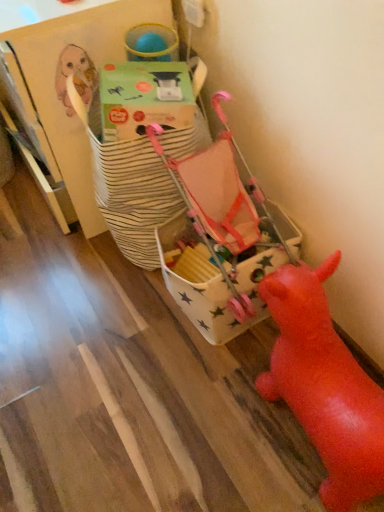
Question: Can you confirm if white star-patterned fabric bag at center, the 1th toy from the back, is wider than rubber red pig at lower right, acting as the second toy starting from the back?

Choices:
 (A) yes
 (B) no

Answer: (A)

Question: Is white star-patterned fabric bag at center, the 1th toy from the back, positioned with its back to rubber red pig at lower right, acting as the second toy starting from the back?

Choices:
 (A) yes
 (B) no

Answer: (B)

Question: Is white star-patterned fabric bag at center, the 1th toy from the back, positioned behind rubber red pig at lower right, acting as the second toy starting from the back?

Choices:
 (A) yes
 (B) no

Answer: (A)

Question: Can you confirm if white star-patterned fabric bag at center, the 1th toy from the back, is smaller than rubber red pig at lower right, acting as the second toy starting from the back?

Choices:
 (A) yes
 (B) no

Answer: (A)

Question: Is white star-patterned fabric bag at center, the 1th toy from the back, thinner than rubber red pig at lower right, the 1th toy in the front-to-back sequence?

Choices:
 (A) no
 (B) yes

Answer: (A)

Question: Can you confirm if white star-patterned fabric bag at center, the 1th toy from the back, is shorter than rubber red pig at lower right, the 1th toy in the front-to-back sequence?

Choices:
 (A) no
 (B) yes

Answer: (B)

Question: Is green cardboard box at upper center oriented towards white star-patterned fabric bag at center, the 1th toy from the back?

Choices:
 (A) yes
 (B) no

Answer: (B)

Question: From the image's perspective, would you say green cardboard box at upper center is shown under white star-patterned fabric bag at center, which is the second toy in front-to-back order?

Choices:
 (A) yes
 (B) no

Answer: (B)

Question: Can you see green cardboard box at upper center touching white star-patterned fabric bag at center, the 1th toy from the back?

Choices:
 (A) no
 (B) yes

Answer: (A)

Question: From a real-world perspective, is green cardboard box at upper center on white star-patterned fabric bag at center, which is the second toy in front-to-back order?

Choices:
 (A) yes
 (B) no

Answer: (A)

Question: Does green cardboard box at upper center come in front of white star-patterned fabric bag at center, the 1th toy from the back?

Choices:
 (A) yes
 (B) no

Answer: (A)

Question: Is green cardboard box at upper center positioned with its back to white star-patterned fabric bag at center, which is the second toy in front-to-back order?

Choices:
 (A) no
 (B) yes

Answer: (A)

Question: From the image's perspective, is white star-patterned fabric bag at center, the 1th toy from the back, over green cardboard box at upper center?

Choices:
 (A) no
 (B) yes

Answer: (A)